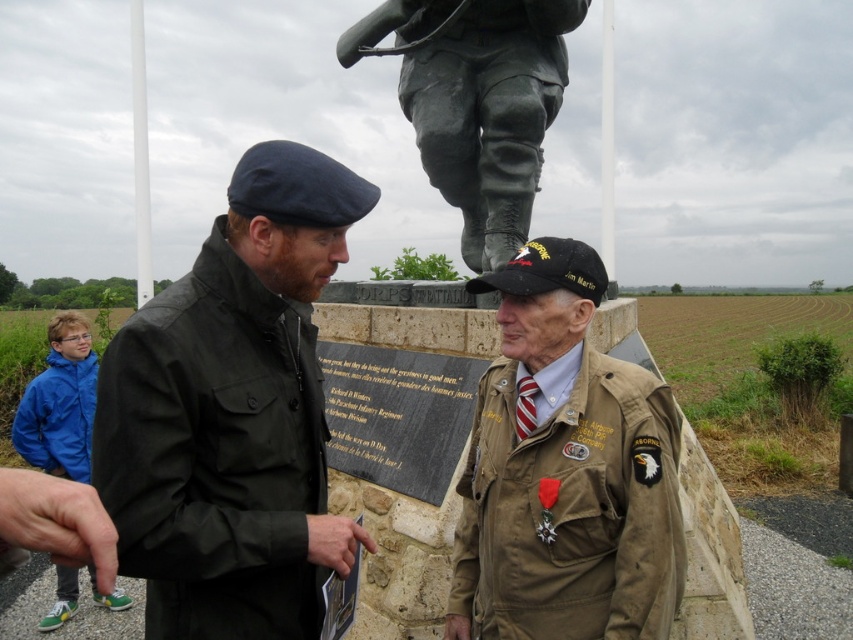
Can you confirm if dark green fabric jacket at center is positioned to the right of bronze statue at upper center?

No, dark green fabric jacket at center is not to the right of bronze statue at upper center.

Is dark green fabric jacket at center taller than bronze statue at upper center?

No.

Between point (170, 467) and point (410, 113), which one is positioned behind?

The point (410, 113) is more distant.

Where is `dark green fabric jacket at center`? dark green fabric jacket at center is located at coordinates (233, 413).

Can you confirm if dark green fabric jacket at center is taller than blue nylon jacket at lower left?

Yes.

The width and height of the screenshot is (853, 640). What do you see at coordinates (233, 413) in the screenshot?
I see `dark green fabric jacket at center` at bounding box center [233, 413].

At what (x,y) coordinates should I click in order to perform the action: click on dark green fabric jacket at center. Please return your answer as a coordinate pair (x, y). The height and width of the screenshot is (640, 853). Looking at the image, I should click on (233, 413).

Where is `dark green fabric jacket at center`? dark green fabric jacket at center is located at coordinates (233, 413).

Does dark green fabric jacket at center have a greater height compared to tan fabric jacket at lower right?

Yes.

Between point (241, 236) and point (503, 524), which one is positioned in front?

Point (241, 236)

Where is `dark green fabric jacket at center`? The image size is (853, 640). dark green fabric jacket at center is located at coordinates (233, 413).